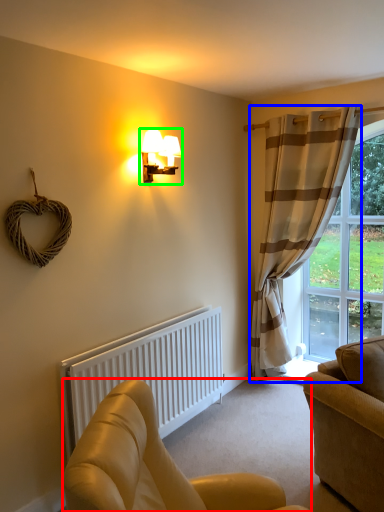
Question: Which is nearer to the studio couch (highlighted by a red box)? curtain (highlighted by a blue box) or lamp (highlighted by a green box).

Choices:
 (A) curtain
 (B) lamp

Answer: (B)